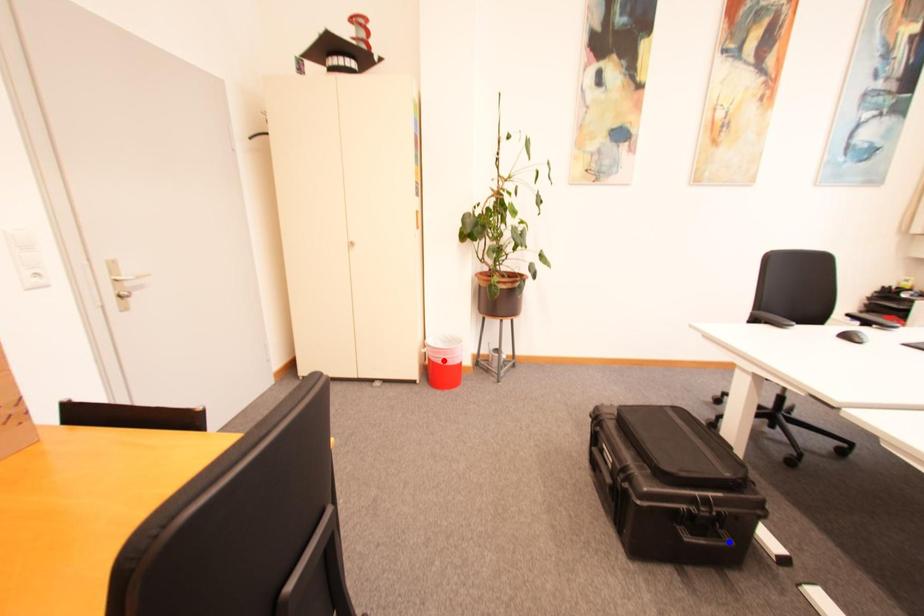
Question: Which of the two points in the image is closer to the camera?

Choices:
 (A) Blue point is closer.
 (B) Red point is closer.

Answer: (A)